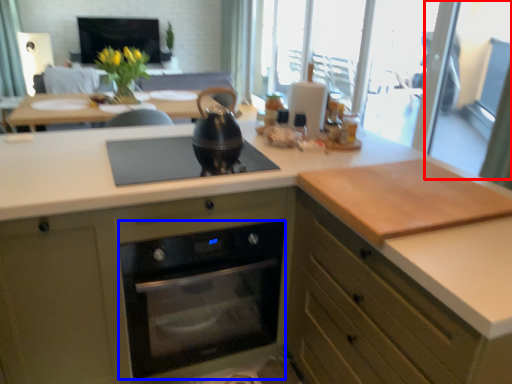
Question: Which of the following is the closest to the observer, screen door (highlighted by a red box) or home appliance (highlighted by a blue box)?

Choices:
 (A) screen door
 (B) home appliance

Answer: (B)